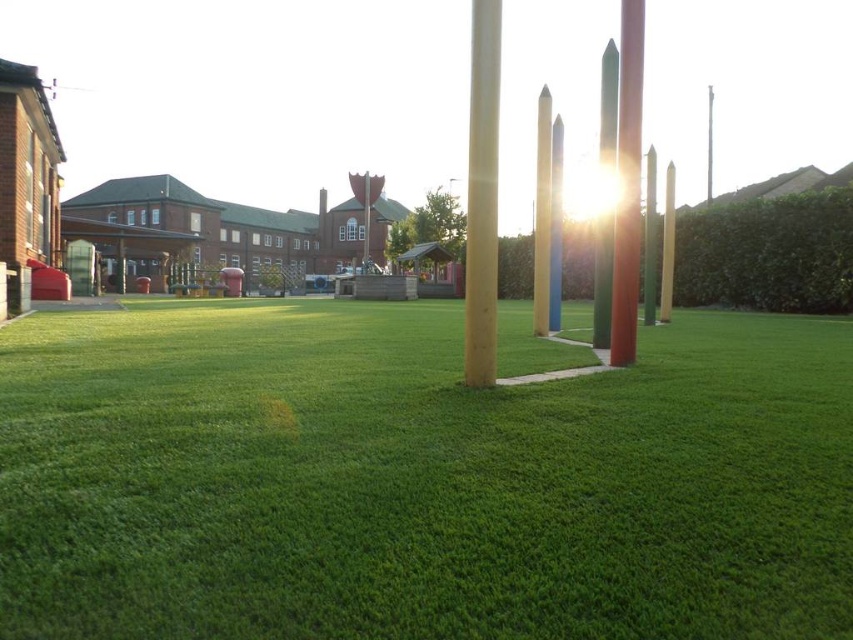
You are standing at the point closest to the camera in the scene. There are two points marked in the image, one at coordinates point (554, 316) and another at point (666, 227). Which point is closer to your current position?

Point (554, 316) is in front of point (666, 227), so it is closer to your current position.

You are standing in the outdoor area and want to touch the green polished pole at center and the smooth red pole at center. Which pole should you reach for first if you want to touch the one closer to you first?

You should reach for the green polished pole at center first because it is closer to you than the smooth red pole at center.

You are standing in the outdoor area and want to place a new bench between the green polished stone pillar at center and the smooth green pole at center. Based on their positions, which side of the bench should face the brick building with the cup detail?

The bench should face the brick building with the cup detail because the green polished stone pillar at center is to the left of the smooth green pole at center, so placing the bench between them would naturally orient it towards the background where the building is located.